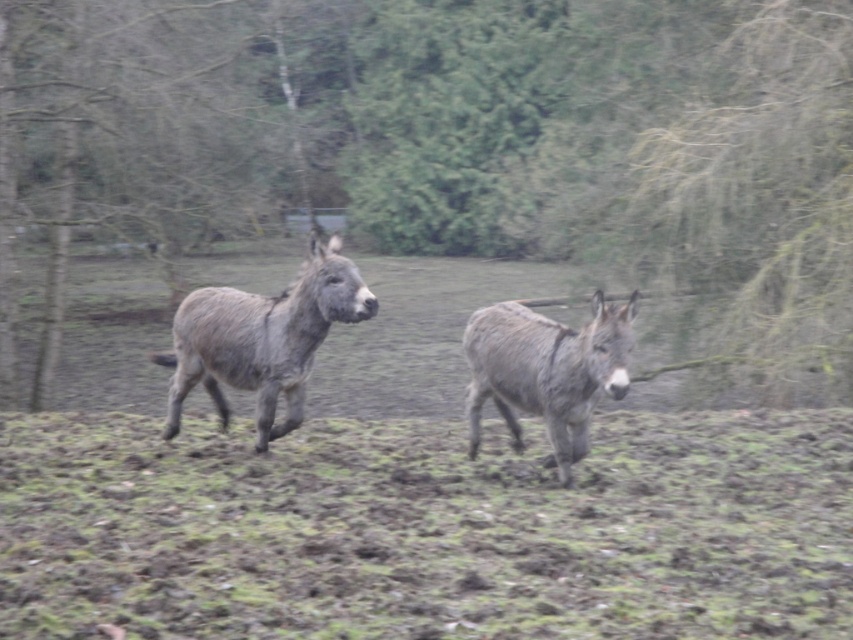
Question: Among these objects, which one is farthest from the camera?

Choices:
 (A) gray rough fur mule at center
 (B) green grass at center
 (C) gray fuzzy mule at left
 (D) green leafy tree at center

Answer: (D)

Question: Among these objects, which one is nearest to the camera?

Choices:
 (A) green leafy tree at center
 (B) gray rough fur mule at center
 (C) gray fuzzy mule at left

Answer: (B)

Question: Does green grass at center appear under gray rough fur mule at center?

Choices:
 (A) no
 (B) yes

Answer: (B)

Question: Is green leafy tree at center bigger than green grass at center?

Choices:
 (A) no
 (B) yes

Answer: (B)

Question: Among these objects, which one is nearest to the camera?

Choices:
 (A) gray fuzzy mule at left
 (B) gray rough fur mule at center
 (C) green grass at center

Answer: (C)

Question: Observing the image, what is the correct spatial positioning of green grass at center in reference to gray rough fur mule at center?

Choices:
 (A) below
 (B) above

Answer: (A)